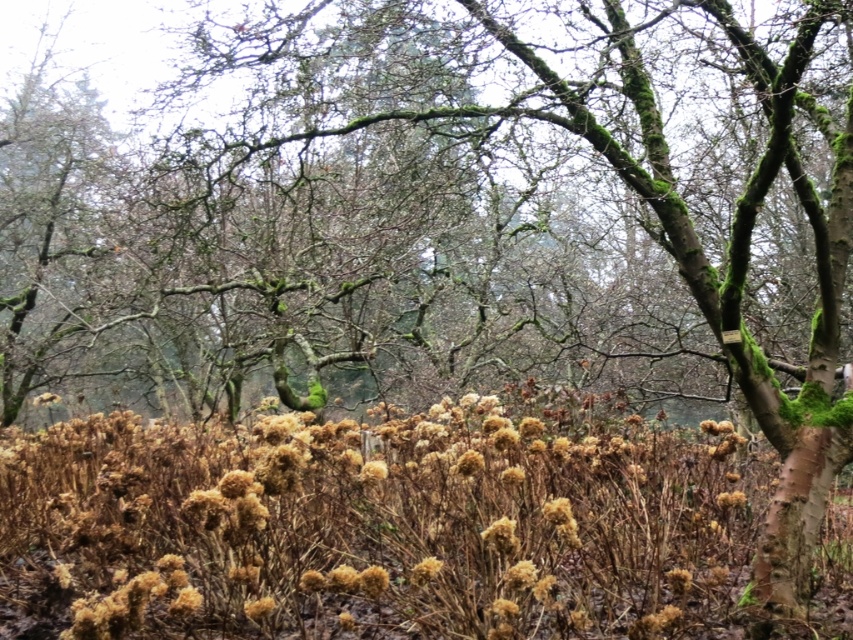
Is brown fluffy plant at center further to the viewer compared to brown fluffy flower at center?

No, it is in front of brown fluffy flower at center.

Consider the image. Is brown fluffy plant at center taller than brown fluffy flower at center?

Indeed, brown fluffy plant at center has a greater height compared to brown fluffy flower at center.

Is point (515, 621) positioned before point (434, 561)?

No, it is behind (434, 561).

Find the location of a particular element. brown fluffy plant at center is located at coordinates (364, 529).